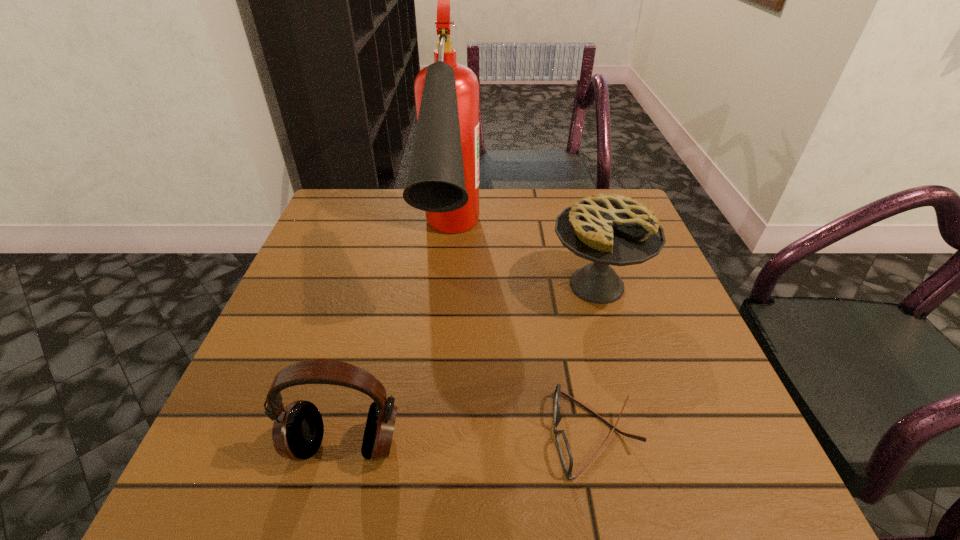
Find the location of a particular element. The height and width of the screenshot is (540, 960). headset at the near edge is located at coordinates (297, 433).

You are a GUI agent. You are given a task and a screenshot of the screen. Output one action in this format:
    pyautogui.click(x=<x>, y=<y>)
    Task: Click on the spectacles that is at the near edge
    
    Given the screenshot: What is the action you would take?
    (564, 450)

The image size is (960, 540). Find the location of `object that is at the left edge`. object that is at the left edge is located at coordinates (297, 433).

Find the location of a particular element. object positioned at the right edge is located at coordinates [x=608, y=229].

Identify the location of object positioned at the near left corner. The height and width of the screenshot is (540, 960). (297, 433).

Image resolution: width=960 pixels, height=540 pixels. In the image, there is a desktop. What are the coordinates of `free region at the far edge` in the screenshot? It's located at (498, 207).

Where is `vacant space at the left edge of the desktop`? The image size is (960, 540). vacant space at the left edge of the desktop is located at coordinates (329, 285).

The width and height of the screenshot is (960, 540). Identify the location of vacant space at the right edge of the desktop. (652, 335).

This screenshot has height=540, width=960. I want to click on free space at the far left corner of the desktop, so tap(374, 217).

Where is `vacant space in between the shortest object and the headset`? This screenshot has height=540, width=960. vacant space in between the shortest object and the headset is located at coordinates (469, 439).